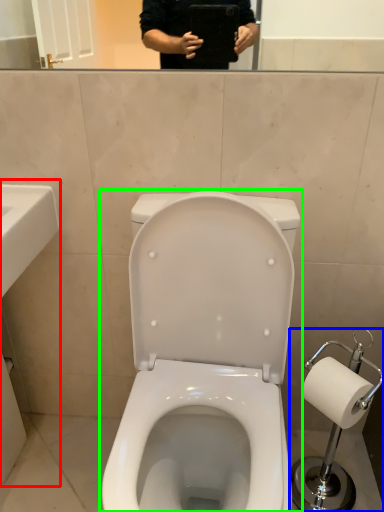
Question: Considering the real-world distances, which object is farthest from sink (highlighted by a red box)? scale (highlighted by a blue box) or toilet (highlighted by a green box)?

Choices:
 (A) scale
 (B) toilet

Answer: (A)